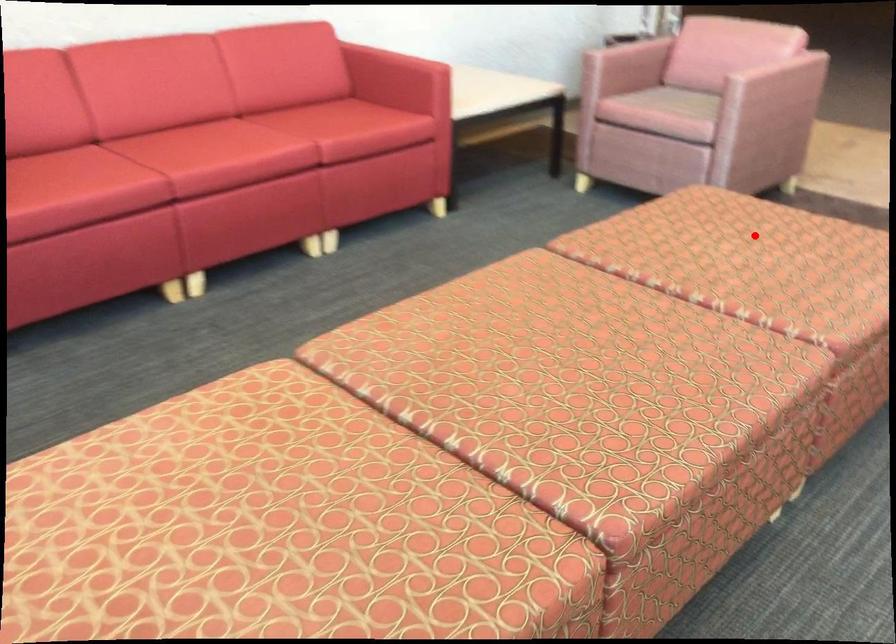
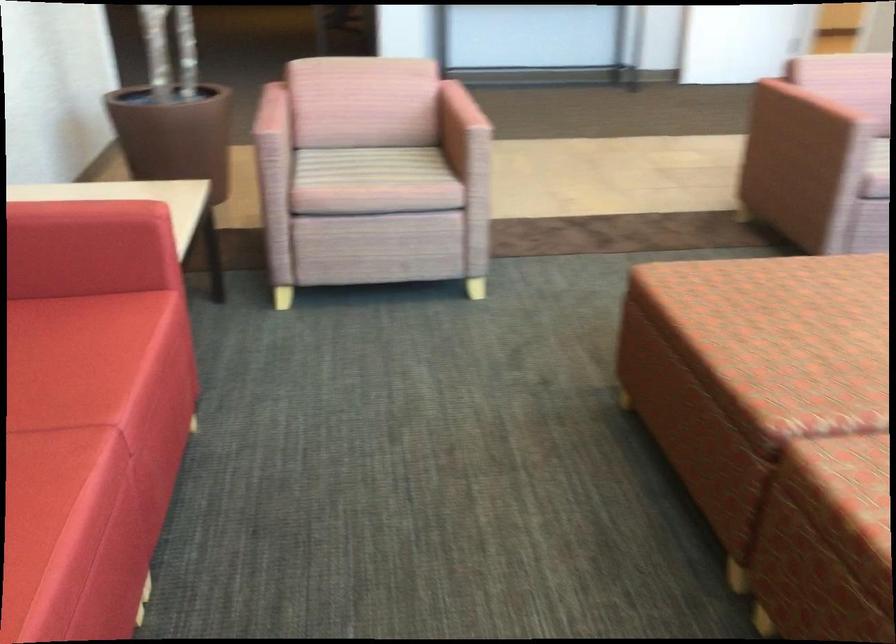
Where in the second image is the point corresponding to the highlighted location from the first image?

(805, 304)